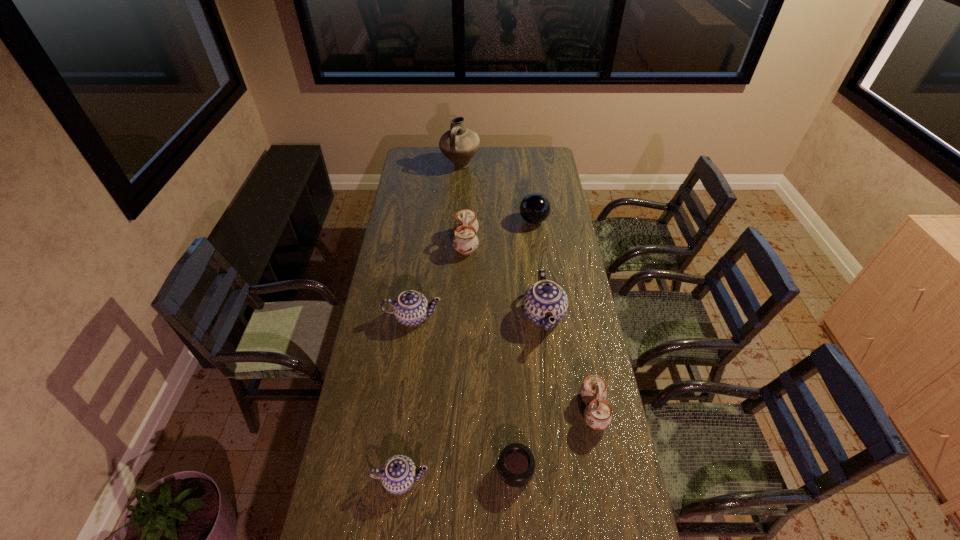
Where is `vacant area in the image that satisfies the following two spatial constraints: 1. on the side of the black bowling ball with the finger holes; 2. at the spout of the rightmost blue chinaware`? vacant area in the image that satisfies the following two spatial constraints: 1. on the side of the black bowling ball with the finger holes; 2. at the spout of the rightmost blue chinaware is located at coordinates (546, 315).

Find the location of a particular element. free region that satisfies the following two spatial constraints: 1. by the handle of the third chinaware from left to right; 2. at the spout of the second biggest blue chinaware is located at coordinates (464, 318).

Identify the location of vacant area in the image that satisfies the following two spatial constraints: 1. at the spout of the rightmost blue chinaware; 2. at the spout of the nearest blue chinaware. The height and width of the screenshot is (540, 960). (564, 480).